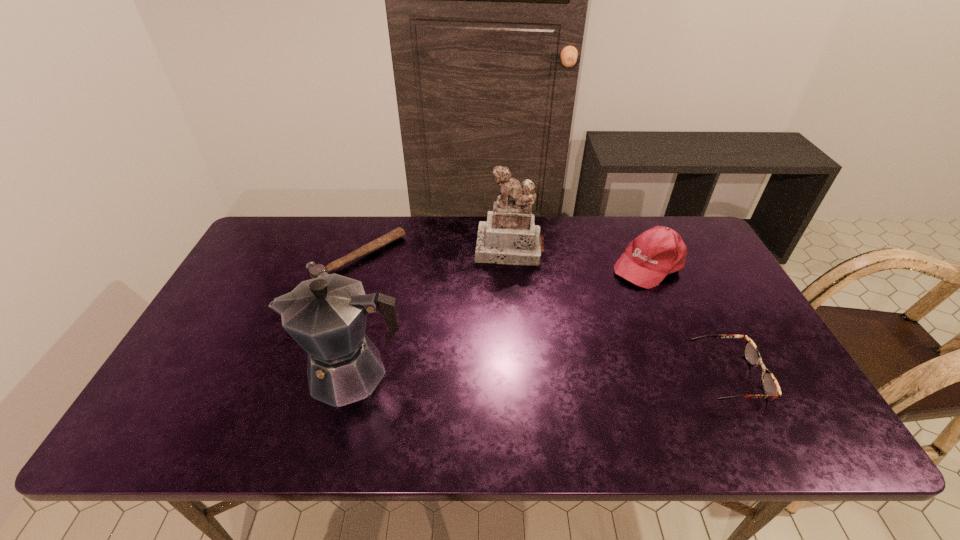
The height and width of the screenshot is (540, 960). What are the coordinates of `vacant position in the image that satisfies the following two spatial constraints: 1. on the front side of the figurine; 2. on the frame of the spectacles` in the screenshot? It's located at (520, 376).

I want to click on vacant region that satisfies the following two spatial constraints: 1. on the front side of the shortest object; 2. on the left side of the baseball cap, so click(356, 264).